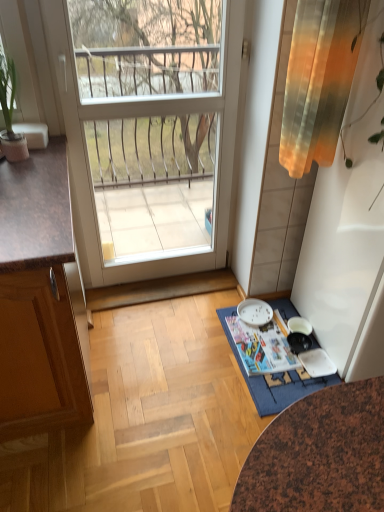
Find the location of `vacant area situated below gradient fabric curtain at upper right (from a real-world perspective)`. vacant area situated below gradient fabric curtain at upper right (from a real-world perspective) is located at coordinates (277, 325).